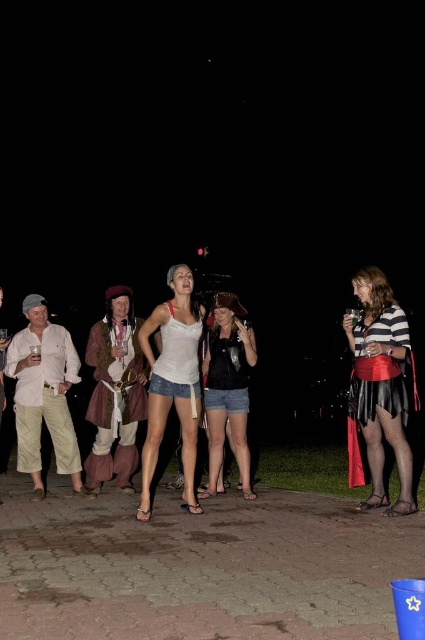
Question: Which of the following is the farthest from the observer?

Choices:
 (A) click(x=368, y=435)
 (B) click(x=20, y=385)
 (C) click(x=243, y=358)
 (D) click(x=129, y=365)

Answer: (D)

Question: Does light beige cotton pants at left appear on the left side of white cotton tank top at center?

Choices:
 (A) yes
 (B) no

Answer: (A)

Question: Does light beige cotton pants at left appear over matte brown leather jacket at center?

Choices:
 (A) no
 (B) yes

Answer: (A)

Question: Which object appears closest to the camera in this image?

Choices:
 (A) striped jersey skirt at center
 (B) matte brown leather jacket at center
 (C) white cotton tank top at center

Answer: (A)

Question: Is matte brown leather jacket at center smaller than white cotton tank top at center?

Choices:
 (A) no
 (B) yes

Answer: (B)

Question: Which object appears closest to the camera in this image?

Choices:
 (A) white cotton tank top at center
 (B) matte black shirt at center

Answer: (A)